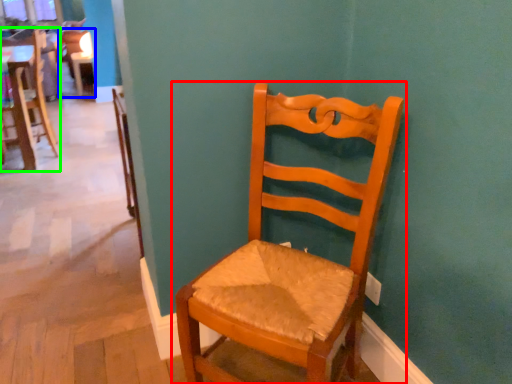
Question: Estimate the real-world distances between objects in this image. Which object is closer to chair (highlighted by a red box), chair (highlighted by a blue box) or chair (highlighted by a green box)?

Choices:
 (A) chair
 (B) chair

Answer: (B)